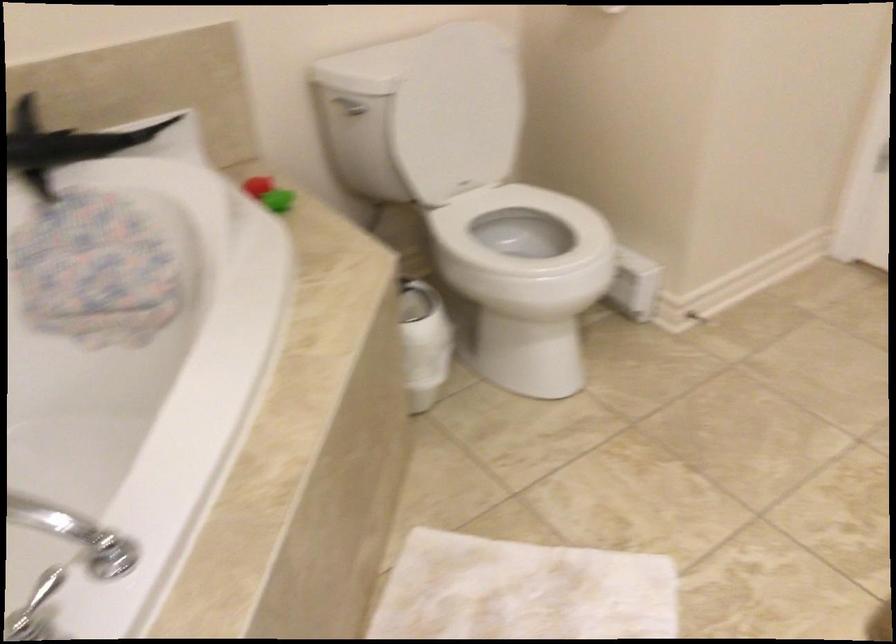
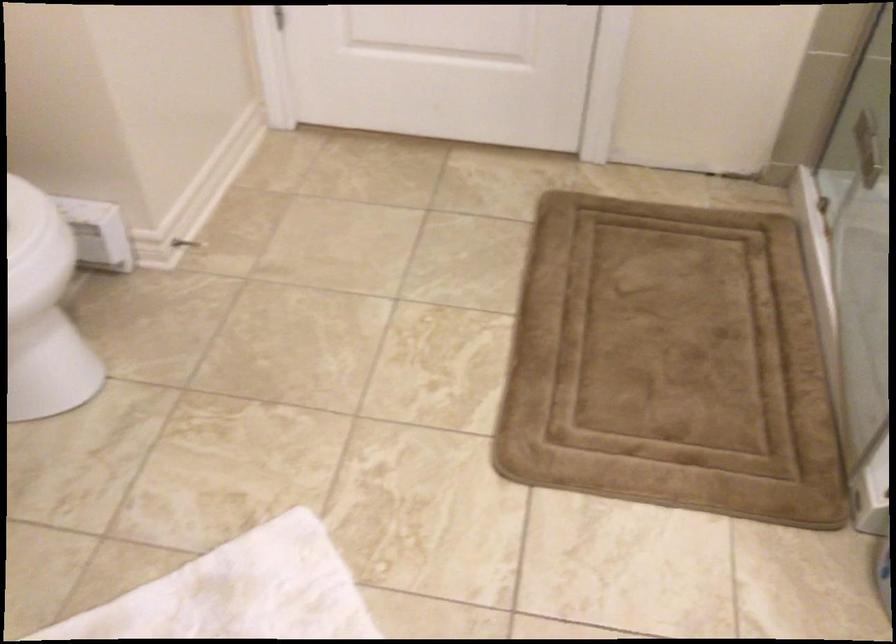
Question: How did the camera likely rotate?

Choices:
 (A) Left
 (B) Right
 (C) Up
 (D) Down

Answer: (B)